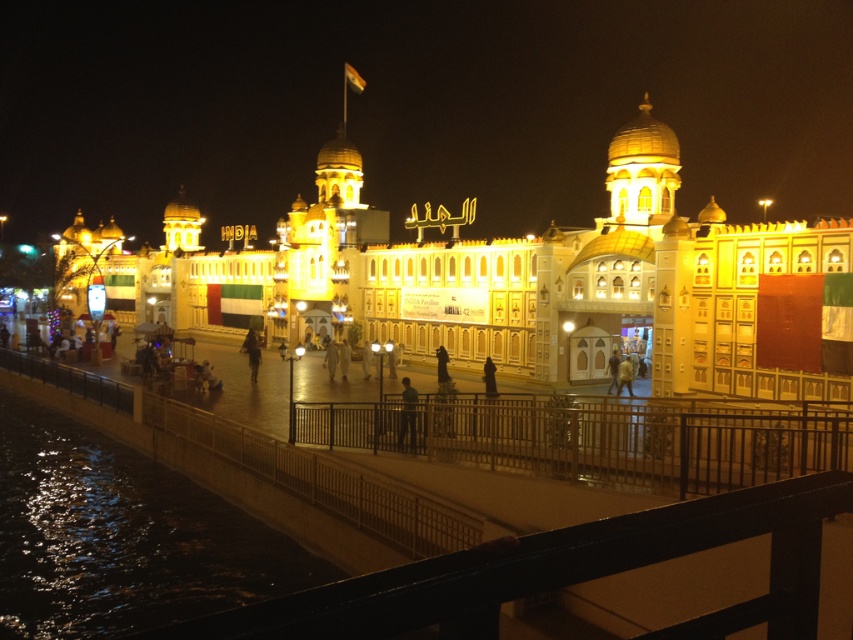
Can you confirm if dark fabric person at center is positioned above dark matte clothing at center?

Yes.

Locate an element on the screen. dark fabric person at center is located at coordinates (251, 353).

Image resolution: width=853 pixels, height=640 pixels. Find the location of `dark fabric person at center`. dark fabric person at center is located at coordinates (251, 353).

Who is more forward, (x=231, y=548) or (x=549, y=461)?

Point (x=549, y=461) is more forward.

Can you confirm if dark reflective water at lower left is positioned above metallic fence at lower center?

Actually, dark reflective water at lower left is below metallic fence at lower center.

Does point (22, 632) lie in front of point (540, 438)?

Yes, point (22, 632) is closer to viewer.

This screenshot has height=640, width=853. I want to click on dark reflective water at lower left, so coord(120,536).

Looking at this image, who is higher up, dark reflective water at lower left or dark blue fabric person at center?

dark blue fabric person at center

Who is more forward, (x=44, y=502) or (x=611, y=374)?

Positioned in front is point (x=44, y=502).

Where is `dark reflective water at lower left`? This screenshot has width=853, height=640. dark reflective water at lower left is located at coordinates pyautogui.click(x=120, y=536).